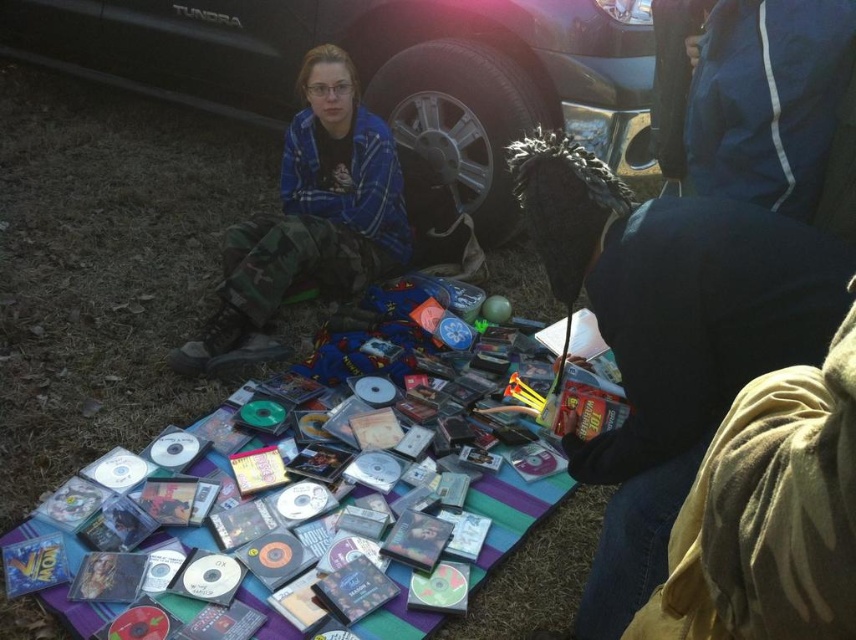
You are a photographer trying to capture both the black metallic truck at upper center and the blue plaid shirt at center in a single frame. Given that the truck is larger than the shirt, where should you position your camera to ensure both are clearly visible in the photo?

Position the camera closer to the blue plaid shirt at center and farther from the black metallic truck at upper center. This way, the shirt will appear larger in the frame, balancing its size with the already bigger truck to ensure both are clearly visible.

You are setting up a temporary market stall and have a limited space. You need to place both the dark blue fabric at lower right and the clear plastic cds at center. Given their sizes, which item should you prioritize placing first to maximize space efficiency?

The dark blue fabric at lower right occupies less space than clear plastic cds at center, so you should prioritize placing the clear plastic cds at center first to ensure they fit properly, then arrange the smaller dark blue fabric at lower right around them.

You are standing at the edge of the scene and need to place a small item on the dark blue fabric at lower right. According to the coordinates provided, where exactly should you place it?

The dark blue fabric at lower right is located at point (667, 337), so you should place the item there.